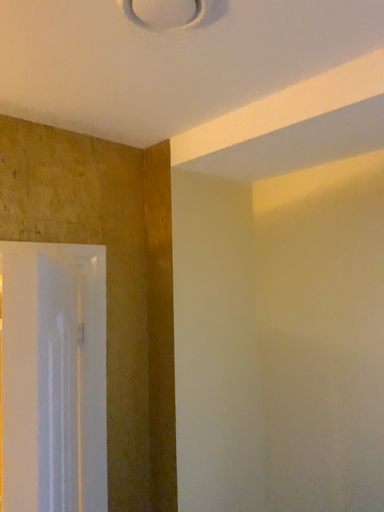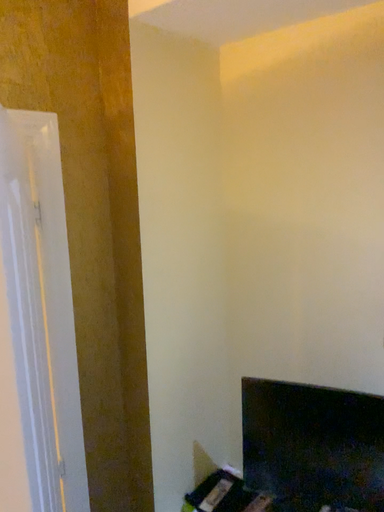
Question: Which way did the camera rotate in the video?

Choices:
 (A) rotated downward
 (B) rotated upward

Answer: (A)